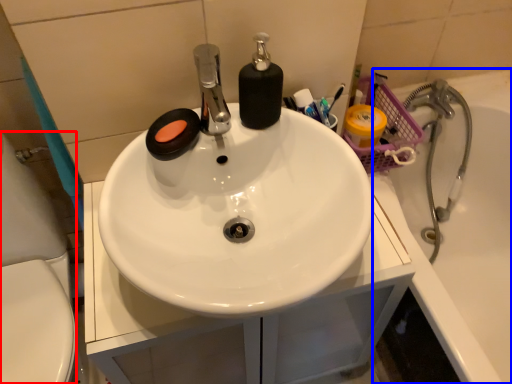
Question: Which of the following is the farthest to the observer, porcelain (highlighted by a red box) or bath (highlighted by a blue box)?

Choices:
 (A) porcelain
 (B) bath

Answer: (B)